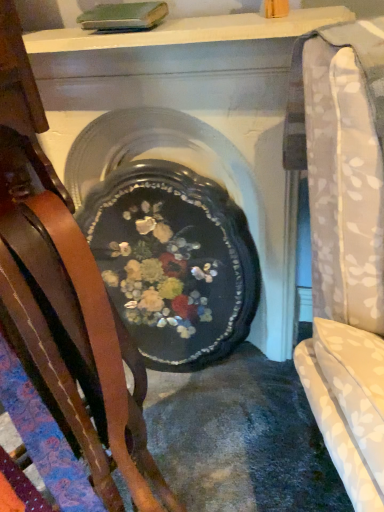
Question: Looking at their shapes, would you say black glossy tray at center is wider or thinner than wooden chair at left?

Choices:
 (A) thin
 (B) wide

Answer: (B)

Question: Which is correct: black glossy tray at center is inside wooden chair at left, or outside of it?

Choices:
 (A) inside
 (B) outside

Answer: (B)

Question: From their relative heights in the image, would you say black glossy tray at center is taller or shorter than wooden chair at left?

Choices:
 (A) short
 (B) tall

Answer: (A)

Question: From a real-world perspective, is wooden chair at left physically located above or below black glossy tray at center?

Choices:
 (A) below
 (B) above

Answer: (B)

Question: In the image, is wooden chair at left positioned in front of or behind black glossy tray at center?

Choices:
 (A) front
 (B) behind

Answer: (A)

Question: In terms of height, does wooden chair at left look taller or shorter compared to black glossy tray at center?

Choices:
 (A) tall
 (B) short

Answer: (A)

Question: Would you say wooden chair at left is inside or outside black glossy tray at center?

Choices:
 (A) inside
 (B) outside

Answer: (B)